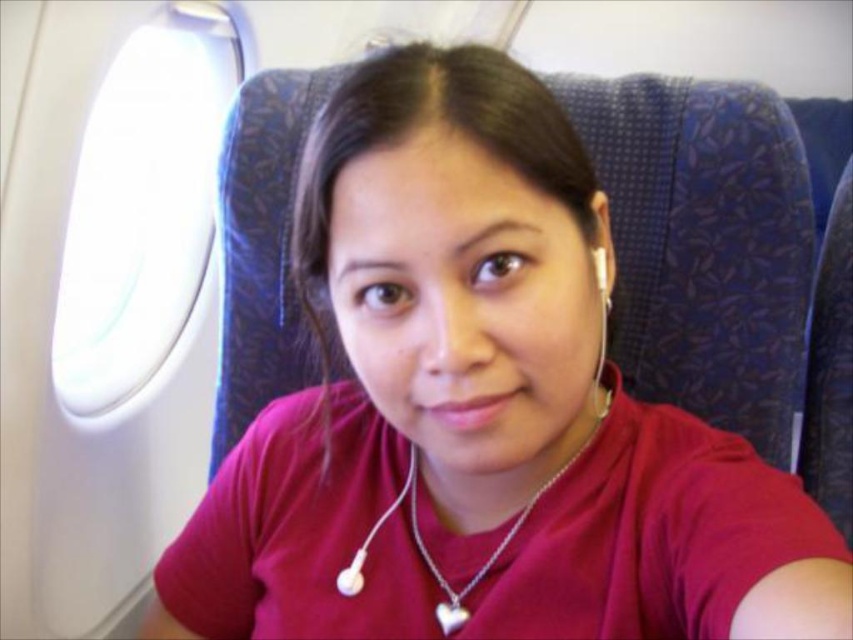
Question: Which object is closer to the camera taking this photo?

Choices:
 (A) transparent plastic airplane window at upper left
 (B) white earbud at center
 (C) silver/chain heart at center

Answer: (C)

Question: Can you confirm if transparent plastic airplane window at upper left is positioned to the right of silver/chain heart at center?

Choices:
 (A) no
 (B) yes

Answer: (A)

Question: Can you confirm if silver/chain heart at center is smaller than white earbud at center?

Choices:
 (A) no
 (B) yes

Answer: (A)

Question: Which object is closer to the camera taking this photo?

Choices:
 (A) silver/chain heart at center
 (B) white earbud at center

Answer: (A)

Question: From the image, what is the correct spatial relationship of silver/chain heart at center in relation to white earbud at center?

Choices:
 (A) left
 (B) right

Answer: (B)

Question: Which point is closer to the camera taking this photo?

Choices:
 (A) (469, 579)
 (B) (521, 513)

Answer: (B)